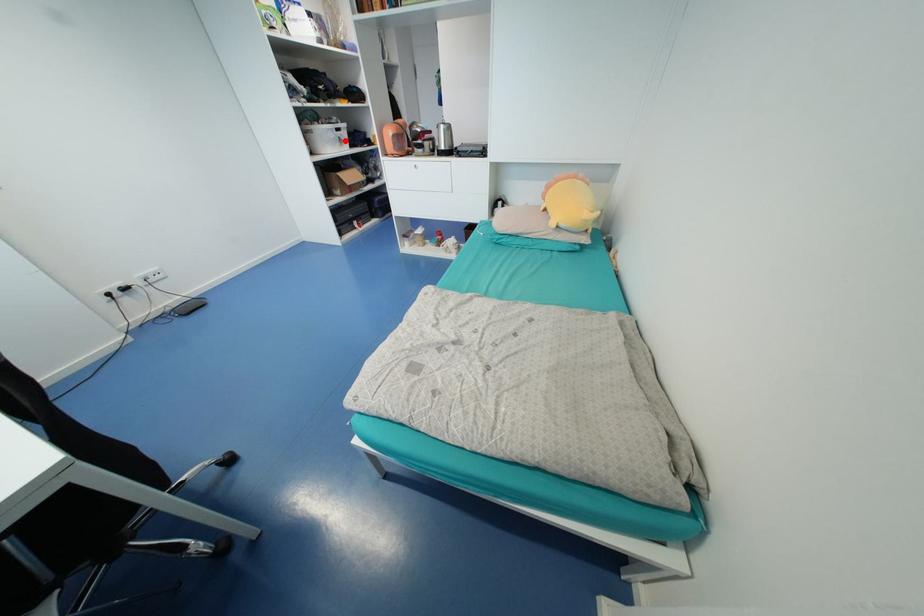
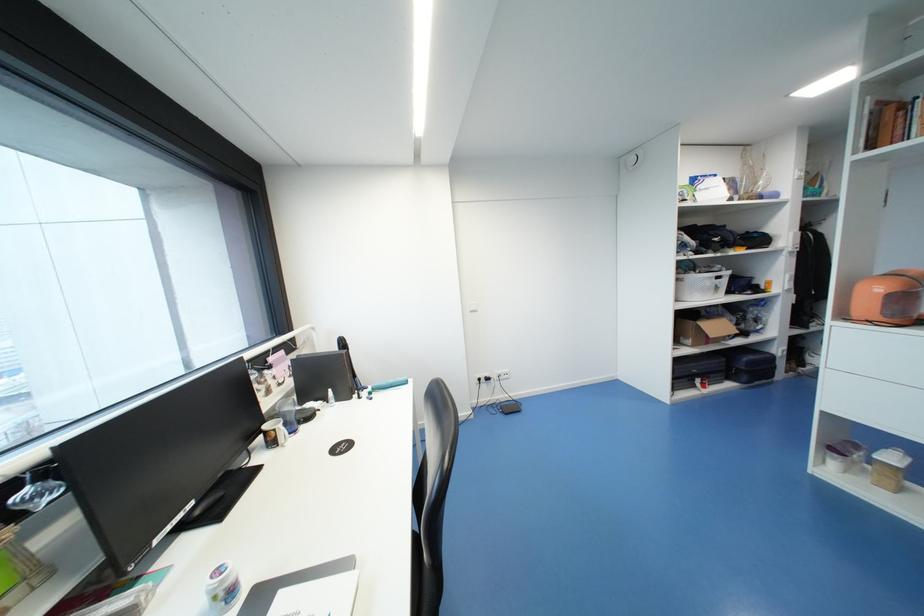
Question: I am providing you with two images of the same scene from different viewpoints. Given a red point in image1, look at the same physical point in image2. Is it:

Choices:
 (A) Closer to the viewpoint
 (B) Farther from the viewpoint

Answer: (B)